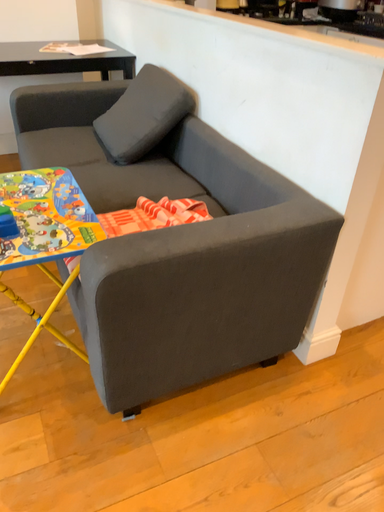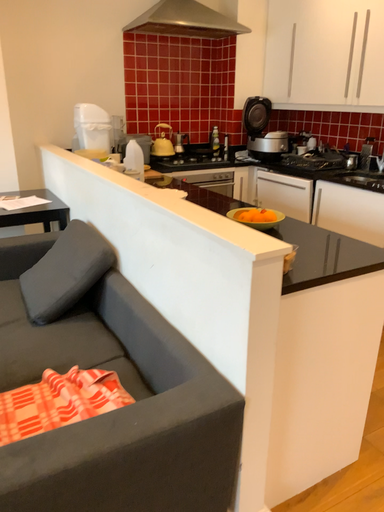
Question: How did the camera likely rotate when shooting the video?

Choices:
 (A) rotated downward
 (B) rotated upward

Answer: (B)